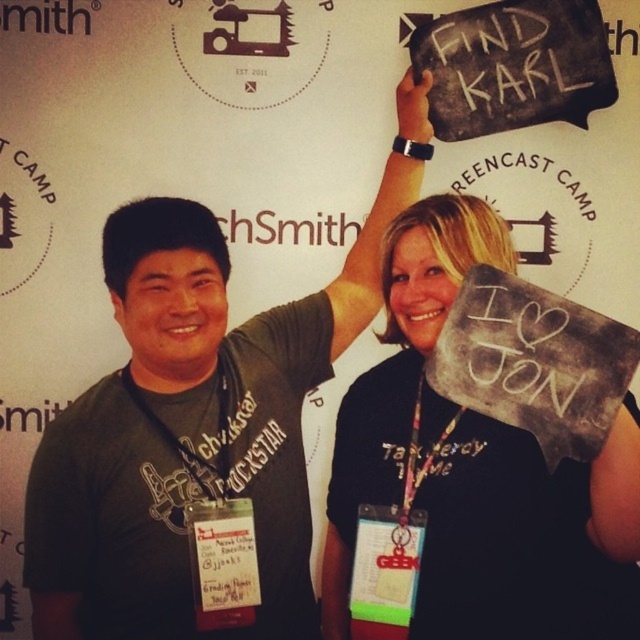
Question: Which object appears closest to the camera in this image?

Choices:
 (A) matte black t-shirt at center
 (B) black fabric sign at upper right

Answer: (B)

Question: Which of the following is the closest to the observer?

Choices:
 (A) green plastic badge at lower center
 (B) matte black t-shirt at center

Answer: (A)

Question: Which object is the farthest from the matte black t-shirt at center?

Choices:
 (A) green plastic badge at lower center
 (B) black fabric sign at upper right

Answer: (A)

Question: Is black fabric sign at upper right positioned behind green plastic badge at lower center?

Choices:
 (A) no
 (B) yes

Answer: (A)

Question: Can you confirm if matte black t-shirt at center is smaller than white chalkboard at upper center?

Choices:
 (A) yes
 (B) no

Answer: (B)

Question: Is matte black t-shirt at center further to camera compared to black fabric sign at upper right?

Choices:
 (A) no
 (B) yes

Answer: (B)